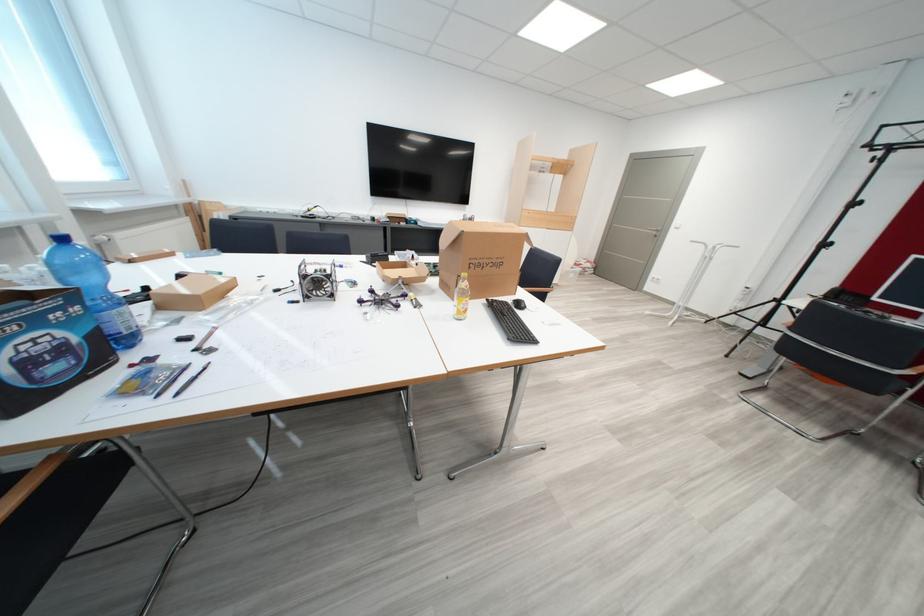
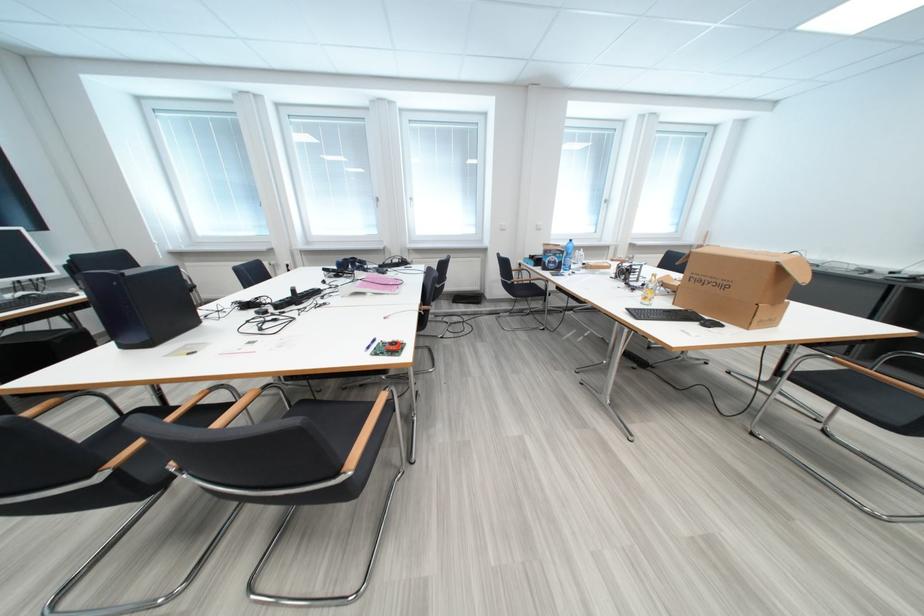
The point at (46, 323) is marked in the first image. Where is the corresponding point in the second image?

(565, 257)